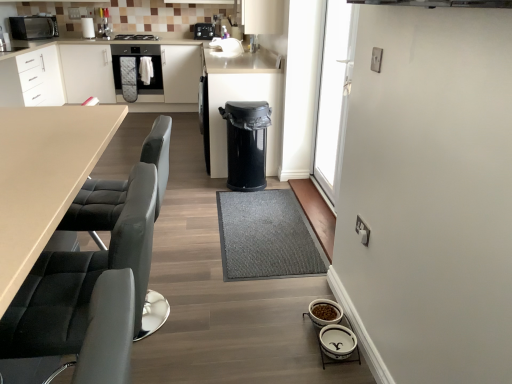
Question: Based on their positions, is white glossy pet bowls at lower right, which appears as the 3th appliance when viewed from the left, located to the left or right of black leather chair at left?

Choices:
 (A) right
 (B) left

Answer: (A)

Question: From a real-world perspective, is white glossy pet bowls at lower right, placed as the first appliance when sorted from bottom to top, positioned above or below black leather chair at left?

Choices:
 (A) above
 (B) below

Answer: (B)

Question: Which of these objects is positioned closest to the white paper towel at upper left, arranged as the second appliance when viewed from the top?

Choices:
 (A) satin black oven at center
 (B) black leather swivel chair at left
 (C) black plastic trash can at center
 (D) matte black microwave at upper left
 (E) gray textured mat at center

Answer: (D)

Question: Based on their relative distances, which object is nearer to the matte white cabinetry at left?

Choices:
 (A) matte black microwave at upper left
 (B) black leather chair at left
 (C) white glossy pet bowls at lower right, placed as the first appliance when sorted from front to back
 (D) gray textured mat at center
 (E) satin black oven at center

Answer: (A)